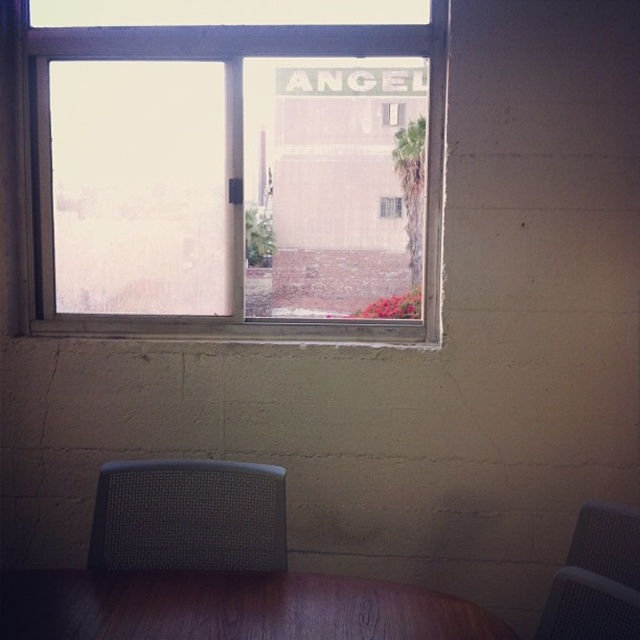
Question: In this image, where is wooden table at lower center located relative to gray mesh chair at lower right?

Choices:
 (A) left
 (B) right

Answer: (A)

Question: Considering the real-world distances, which object is closest to the gray mesh chair at lower left?

Choices:
 (A) wooden table at lower center
 (B) transparent glass window at center
 (C) gray mesh chair at lower right
 (D) clear glass window at upper center

Answer: (A)

Question: Can you confirm if wooden table at lower center is positioned below transparent glass window at center?

Choices:
 (A) no
 (B) yes

Answer: (B)

Question: Which object is closer to the camera taking this photo?

Choices:
 (A) wooden table at lower center
 (B) transparent glass window at center
 (C) clear glass window at upper center
 (D) gray mesh chair at lower right

Answer: (A)

Question: Which object appears farthest from the camera in this image?

Choices:
 (A) gray mesh chair at lower right
 (B) gray mesh chair at lower left
 (C) clear glass window at center
 (D) transparent glass window at center

Answer: (C)

Question: Does gray mesh chair at lower right appear on the right side of clear glass window at center?

Choices:
 (A) no
 (B) yes

Answer: (B)